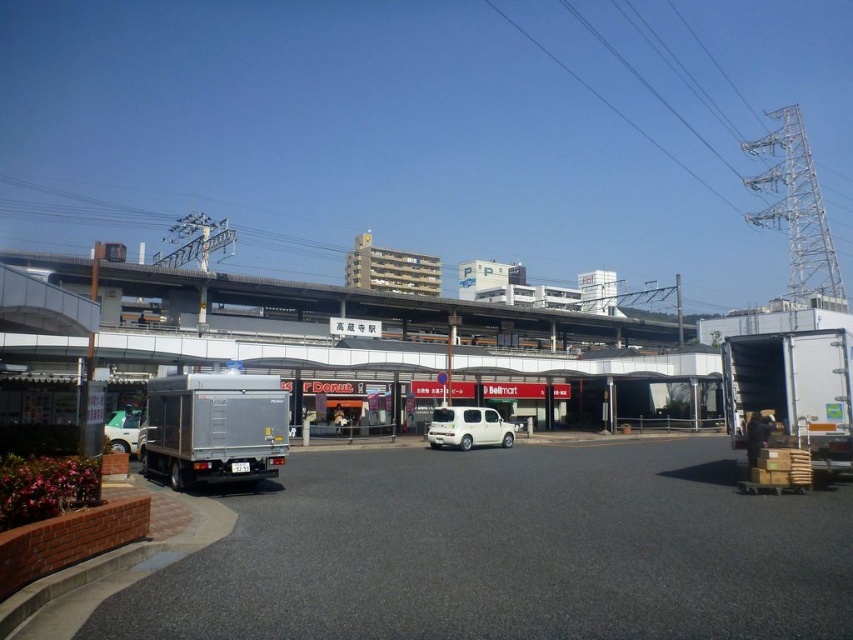
Question: Which object is closer to the camera taking this photo?

Choices:
 (A) silver metallic truck at lower left
 (B) white matte truck at right
 (C) white matte van at center

Answer: (B)

Question: Does white matte van at center appear on the left side of silver metallic truck at lower left?

Choices:
 (A) yes
 (B) no

Answer: (B)

Question: Which object is closer to the camera taking this photo?

Choices:
 (A) white matte truck at right
 (B) white metallic power line at upper right

Answer: (A)

Question: Which point is closer to the camera?

Choices:
 (A) white matte truck at right
 (B) metallic gray overpass at center
 (C) silver metallic trailer truck at lower left
 (D) white matte van at center

Answer: (A)

Question: Can you confirm if metallic gray overpass at center is smaller than white matte van at center?

Choices:
 (A) yes
 (B) no

Answer: (B)

Question: Can you confirm if white metallic power line at upper right is smaller than silver metallic truck at lower left?

Choices:
 (A) no
 (B) yes

Answer: (A)